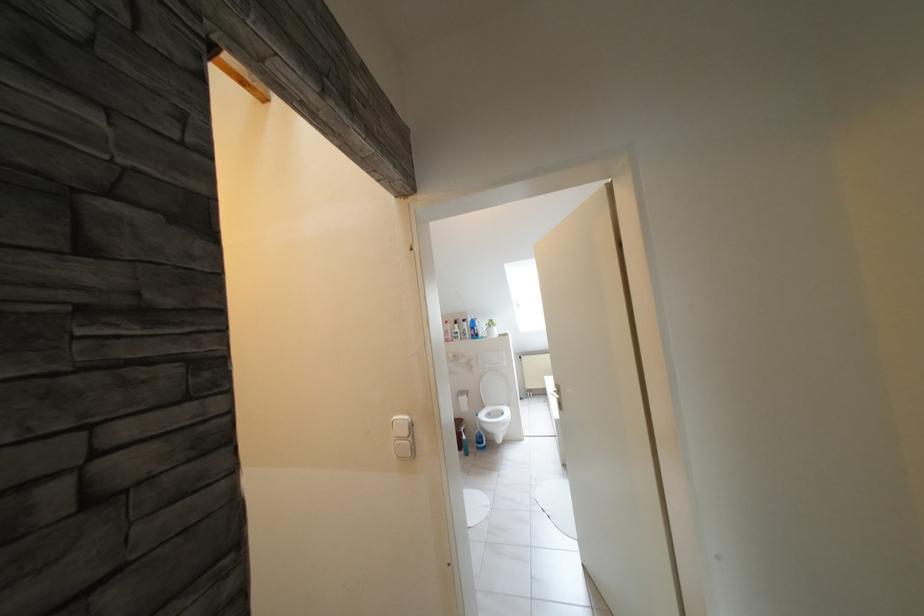
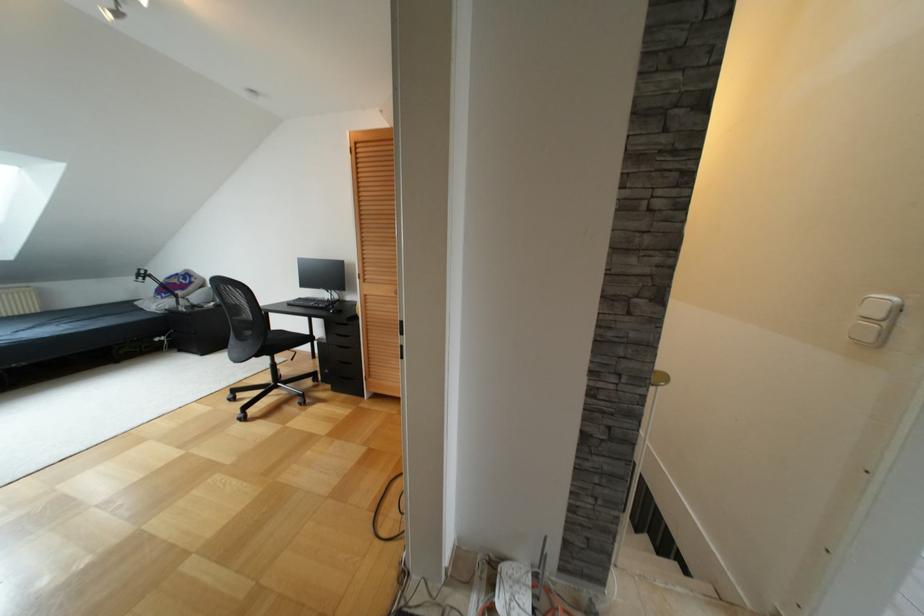
How did the camera likely rotate?

The camera rotated toward left-down.